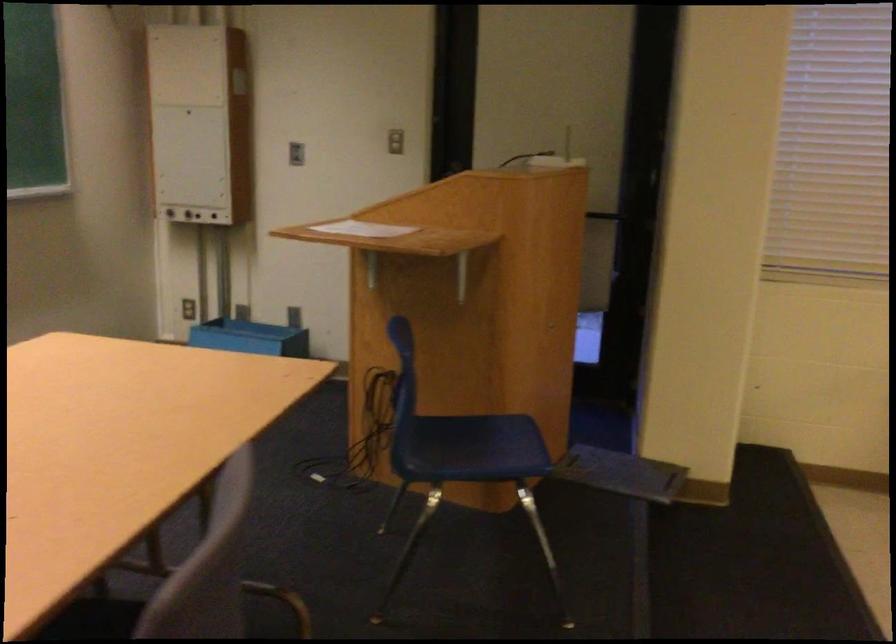
Where would you sit the blue chair sitting surface? Please return your answer as a coordinate pair (x, y).

(466, 442)